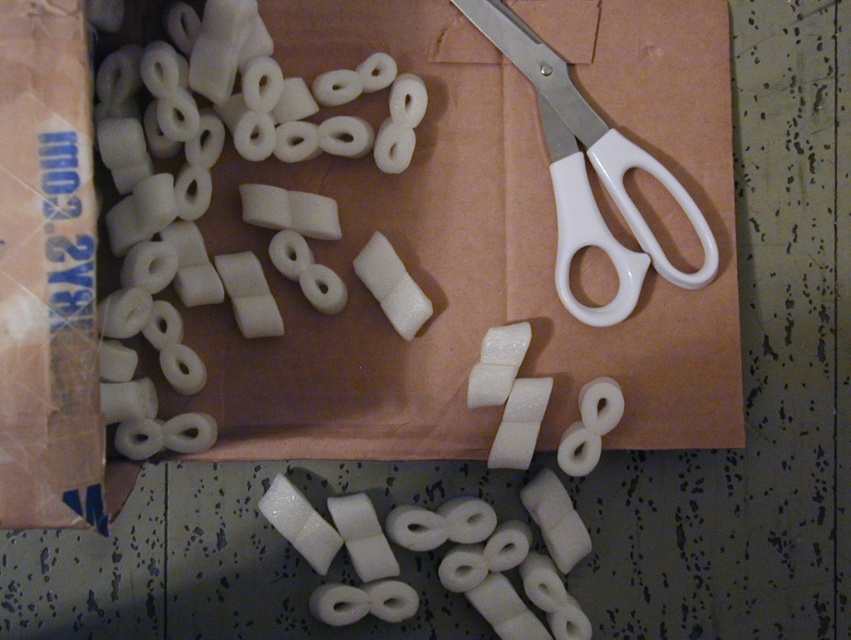
Question: Does white matte toilet paper at lower center appear on the right side of white plastic scissors at upper right?

Choices:
 (A) yes
 (B) no

Answer: (B)

Question: Is white matte toilet paper at lower center above white plastic scissors at upper right?

Choices:
 (A) no
 (B) yes

Answer: (A)

Question: Does matte brown cardboard at upper center appear on the left side of white matte toilet paper at lower center?

Choices:
 (A) no
 (B) yes

Answer: (B)

Question: Which object appears farthest from the camera in this image?

Choices:
 (A) white plastic scissors at upper right
 (B) white matte toilet paper at lower center

Answer: (A)

Question: Estimate the real-world distances between objects in this image. Which object is farther from the white plastic scissors at upper right?

Choices:
 (A) white matte toilet paper at lower center
 (B) matte brown cardboard at upper center

Answer: (A)

Question: Which point is closer to the camera?

Choices:
 (A) (427, 512)
 (B) (397, 412)
 (C) (690, 224)

Answer: (A)